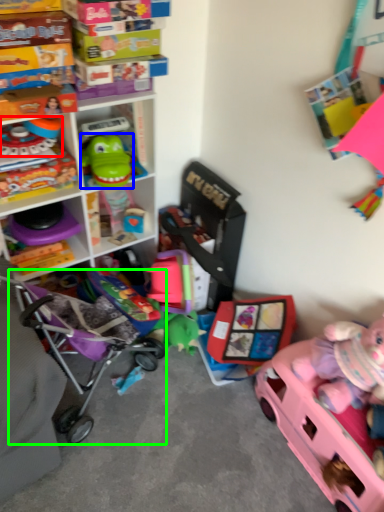
Question: Which is nearer to the toy (highlighted by a red box)? toy (highlighted by a blue box) or baby carriage (highlighted by a green box).

Choices:
 (A) toy
 (B) baby carriage

Answer: (A)